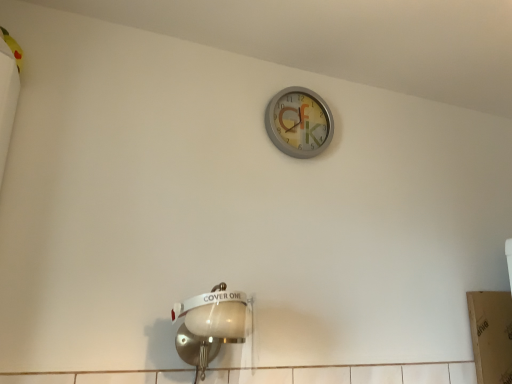
Question: Is metallic silver clock at upper center looking in the opposite direction of white glossy light fixture at lower left?

Choices:
 (A) no
 (B) yes

Answer: (A)

Question: Are metallic silver clock at upper center and white glossy light fixture at lower left far apart?

Choices:
 (A) yes
 (B) no

Answer: (B)

Question: Are metallic silver clock at upper center and white glossy light fixture at lower left making contact?

Choices:
 (A) no
 (B) yes

Answer: (A)

Question: From a real-world perspective, does metallic silver clock at upper center stand above white glossy light fixture at lower left?

Choices:
 (A) yes
 (B) no

Answer: (A)

Question: Is metallic silver clock at upper center further to the viewer compared to white glossy light fixture at lower left?

Choices:
 (A) no
 (B) yes

Answer: (B)

Question: From the image's perspective, is metallic silver clock at upper center under white glossy light fixture at lower left?

Choices:
 (A) yes
 (B) no

Answer: (B)

Question: Is white glossy light fixture at lower left completely or partially outside of metallic silver clock at upper center?

Choices:
 (A) yes
 (B) no

Answer: (A)

Question: From the image's perspective, is white glossy light fixture at lower left on top of metallic silver clock at upper center?

Choices:
 (A) yes
 (B) no

Answer: (B)

Question: Is white glossy light fixture at lower left at the right side of metallic silver clock at upper center?

Choices:
 (A) no
 (B) yes

Answer: (A)

Question: Is white glossy light fixture at lower left aimed at metallic silver clock at upper center?

Choices:
 (A) yes
 (B) no

Answer: (B)

Question: Does white glossy light fixture at lower left lie in front of metallic silver clock at upper center?

Choices:
 (A) yes
 (B) no

Answer: (A)

Question: Does white glossy light fixture at lower left have a larger size compared to metallic silver clock at upper center?

Choices:
 (A) yes
 (B) no

Answer: (A)

Question: Does point (307, 107) appear closer or farther from the camera than point (217, 301)?

Choices:
 (A) farther
 (B) closer

Answer: (A)